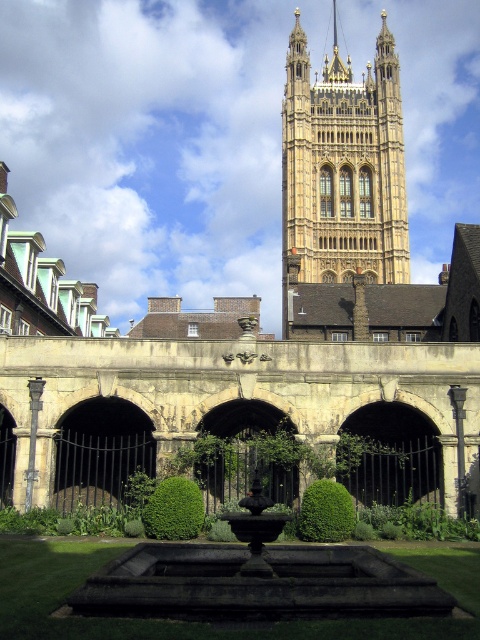
Question: Does golden stone tower at upper center have a larger size compared to dark stone fountain at center?

Choices:
 (A) no
 (B) yes

Answer: (B)

Question: Does golden stone tower at upper center come in front of dark stone fountain at center?

Choices:
 (A) no
 (B) yes

Answer: (A)

Question: Which of the following is the closest to the observer?

Choices:
 (A) (247, 588)
 (B) (383, 179)

Answer: (A)

Question: Among these points, which one is nearest to the camera?

Choices:
 (A) (206, 548)
 (B) (400, 164)

Answer: (A)

Question: Is golden stone tower at upper center in front of dark stone fountain at center?

Choices:
 (A) no
 (B) yes

Answer: (A)

Question: Which of the following is the farthest from the observer?

Choices:
 (A) (362, 612)
 (B) (379, 136)

Answer: (B)